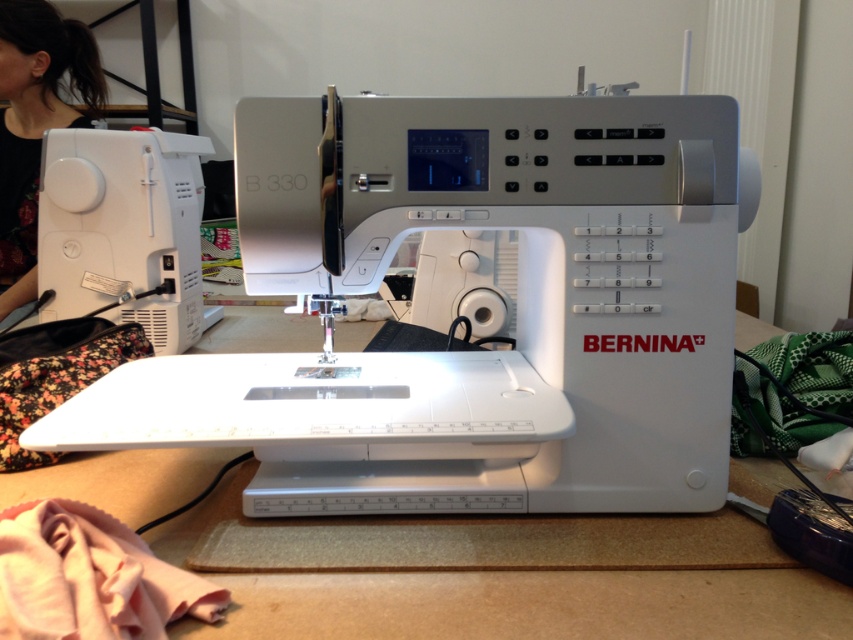
From the picture: Which is more to the left, white plastic sewing machine at center or black fabric at upper left?

From the viewer's perspective, black fabric at upper left appears more on the left side.

You are a GUI agent. You are given a task and a screenshot of the screen. Output one action in this format:
    pyautogui.click(x=<x>, y=<y>)
    Task: Click on the white plastic sewing machine at center
    
    Given the screenshot: What is the action you would take?
    pyautogui.click(x=505, y=321)

Is white plastic sewing machine at center thinner than white plastic sewing machine at left?

No.

Locate an element on the screen. white plastic sewing machine at center is located at coordinates (505, 321).

Identify the location of white plastic sewing machine at center. The width and height of the screenshot is (853, 640). (505, 321).

What are the coordinates of `white plastic sewing machine at left` in the screenshot? It's located at (123, 228).

Image resolution: width=853 pixels, height=640 pixels. Find the location of `white plastic sewing machine at left`. white plastic sewing machine at left is located at coordinates (123, 228).